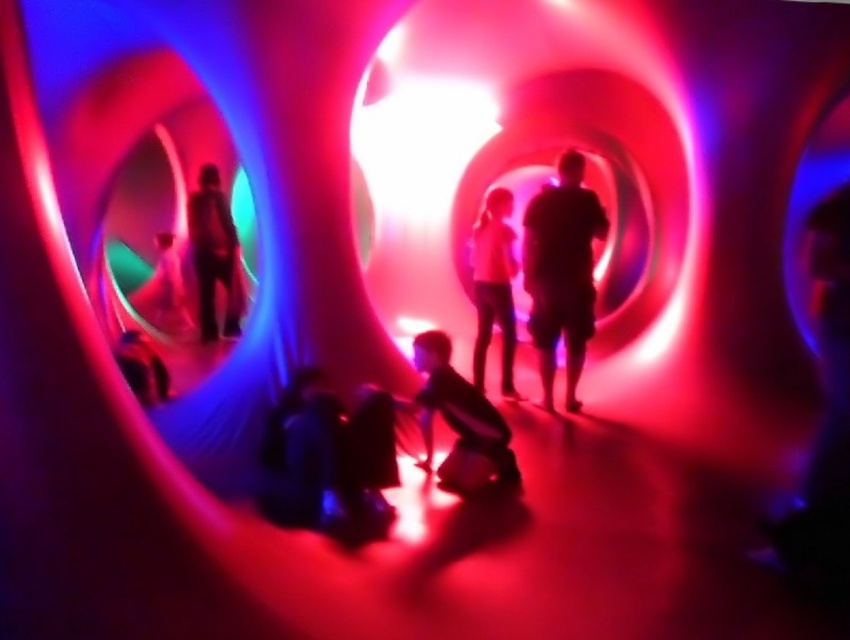
Question: Which of the following is the closest to the observer?

Choices:
 (A) (508, 458)
 (B) (581, 323)
 (C) (483, 324)
 (D) (231, 308)

Answer: (A)

Question: Does silhouette human at center have a smaller size compared to pink matte shirt at center?

Choices:
 (A) no
 (B) yes

Answer: (A)

Question: Is pink matte shirt at center above matte black suit at center?

Choices:
 (A) no
 (B) yes

Answer: (A)

Question: Is silhouette human at center to the left of pink matte shirt at center from the viewer's perspective?

Choices:
 (A) yes
 (B) no

Answer: (B)

Question: Which of the following is the closest to the observer?

Choices:
 (A) (510, 307)
 (B) (545, 353)
 (C) (227, 216)
 (D) (460, 484)

Answer: (D)

Question: Estimate the real-world distances between objects in this image. Which object is farther from the matte black suit at center?

Choices:
 (A) dark matte clothing at center
 (B) pink matte shirt at center
 (C) silhouette human at center

Answer: (A)